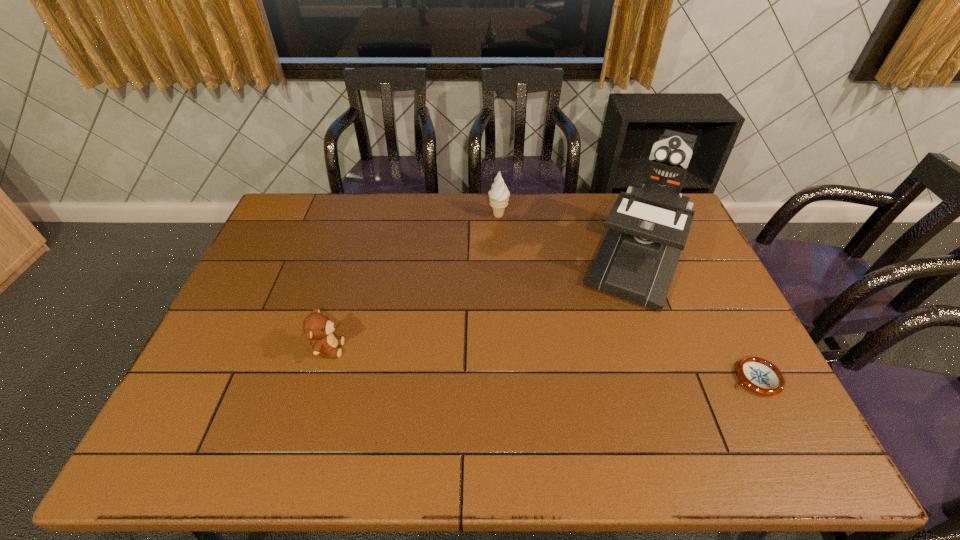
The width and height of the screenshot is (960, 540). I want to click on free point between the shortest object and the microscope, so click(x=696, y=320).

Image resolution: width=960 pixels, height=540 pixels. Find the location of `unoccupied area between the compass and the teddy bear`. unoccupied area between the compass and the teddy bear is located at coordinates (542, 363).

This screenshot has width=960, height=540. What are the coordinates of `free area in between the compass and the microscope` in the screenshot? It's located at (696, 320).

The height and width of the screenshot is (540, 960). I want to click on vacant point located between the microscope and the teddy bear, so click(483, 305).

Locate which object is the closest to the second object from left to right. Please provide its 2D coordinates. Your answer should be formatted as a tuple, i.e. [(x, y)], where the tuple contains the x and y coordinates of a point satisfying the conditions above.

[(648, 225)]

Identify which object is located as the third nearest to the second tallest object. Please provide its 2D coordinates. Your answer should be formatted as a tuple, i.e. [(x, y)], where the tuple contains the x and y coordinates of a point satisfying the conditions above.

[(759, 375)]